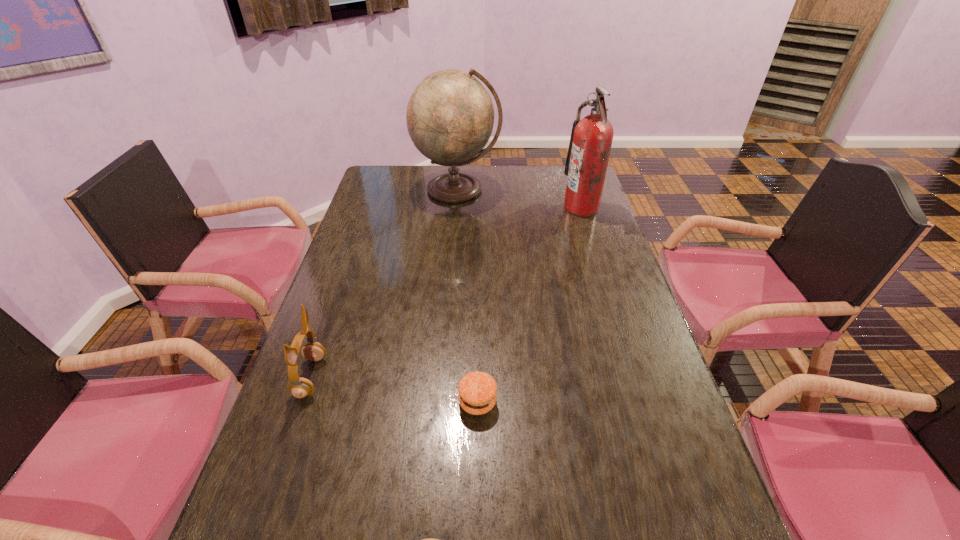
The height and width of the screenshot is (540, 960). In the image, there is a desktop. In order to click on vacant space at the far left corner in this screenshot , I will do `click(398, 172)`.

I want to click on empty location between the taller patty and the fire extinguisher, so click(x=529, y=305).

Find the location of `vacant space that's between the globe and the earphone`. vacant space that's between the globe and the earphone is located at coordinates [384, 283].

Where is `free space between the farther patty and the leftmost object`? free space between the farther patty and the leftmost object is located at coordinates (395, 389).

This screenshot has width=960, height=540. What are the coordinates of `vacant space that's between the taller patty and the earphone` in the screenshot? It's located at (395, 389).

Locate an element on the screen. The width and height of the screenshot is (960, 540). free space between the rightmost object and the second shortest object is located at coordinates (529, 305).

In order to click on empty location between the leftmost object and the globe in this screenshot , I will do `click(384, 283)`.

Image resolution: width=960 pixels, height=540 pixels. I want to click on object that can be found as the third closest to the rightmost object, so click(300, 387).

Where is `object that is the fourth closest to the third shortest object`? This screenshot has width=960, height=540. object that is the fourth closest to the third shortest object is located at coordinates (591, 139).

This screenshot has width=960, height=540. I want to click on free spot that satisfies the following two spatial constraints: 1. on the front-facing side of the taller patty; 2. on the left side of the globe, so click(x=441, y=402).